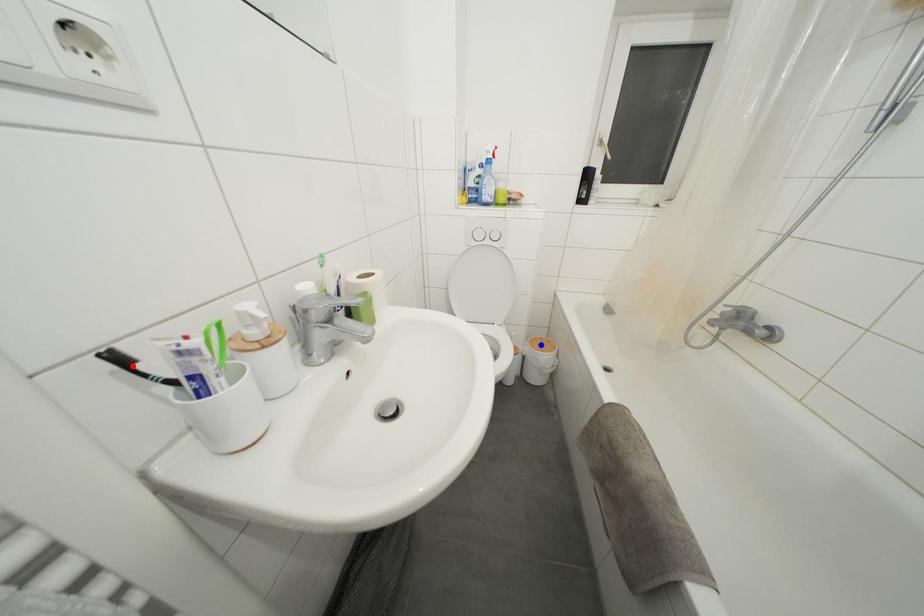
Question: Which of the two points in the image is closer to the camera?

Choices:
 (A) Blue point is closer.
 (B) Red point is closer.

Answer: (B)